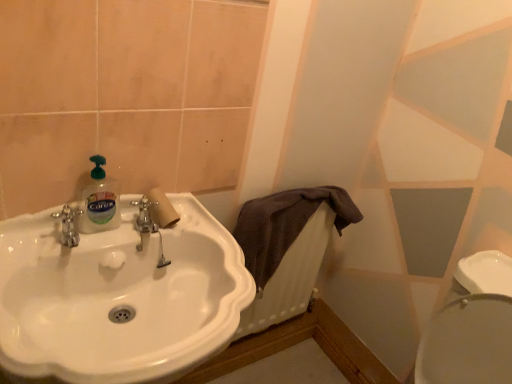
Where is `vacant space situated above brown fabric radiator at center (from a real-world perspective)`? This screenshot has width=512, height=384. vacant space situated above brown fabric radiator at center (from a real-world perspective) is located at coordinates (301, 192).